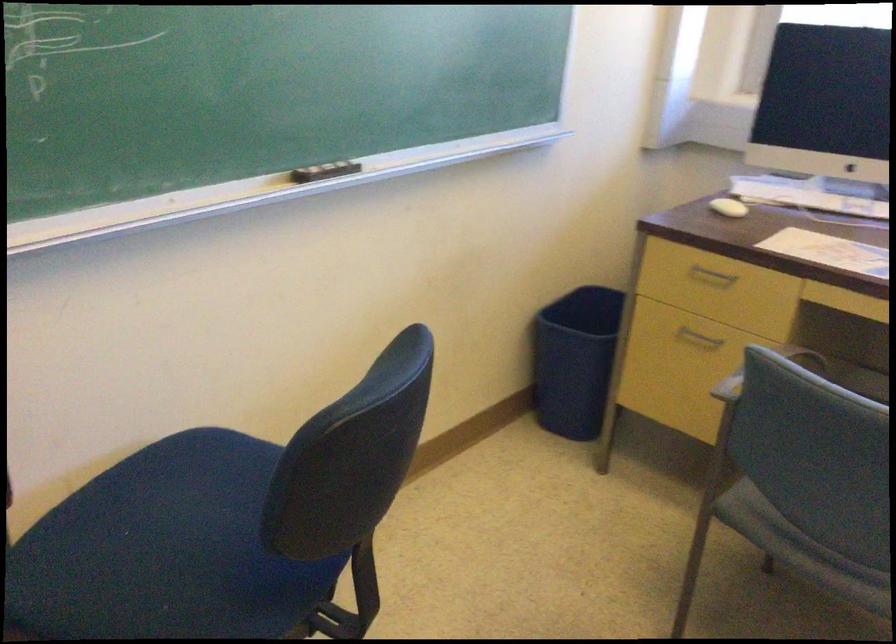
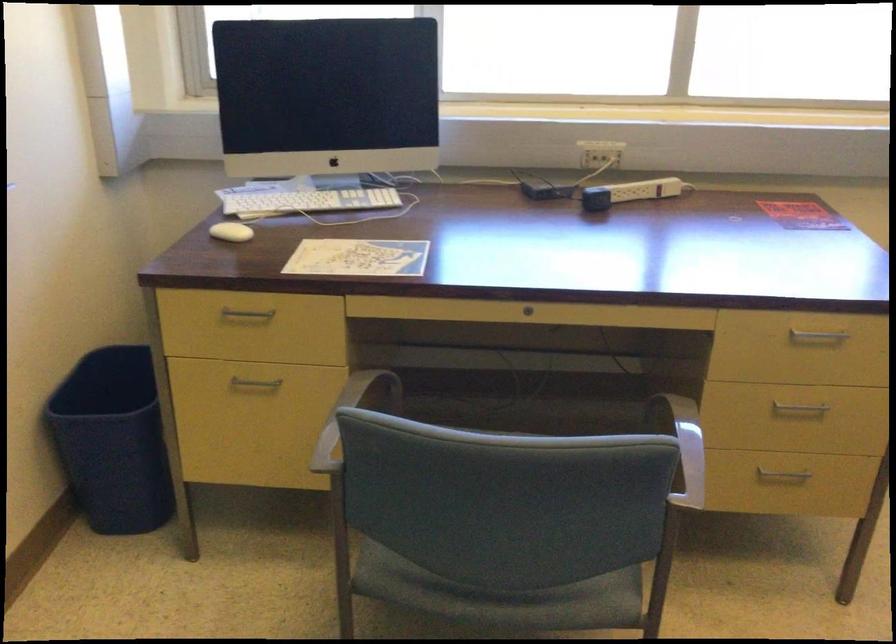
The point at (x=717, y=269) is marked in the first image. Where is the corresponding point in the second image?

(247, 313)